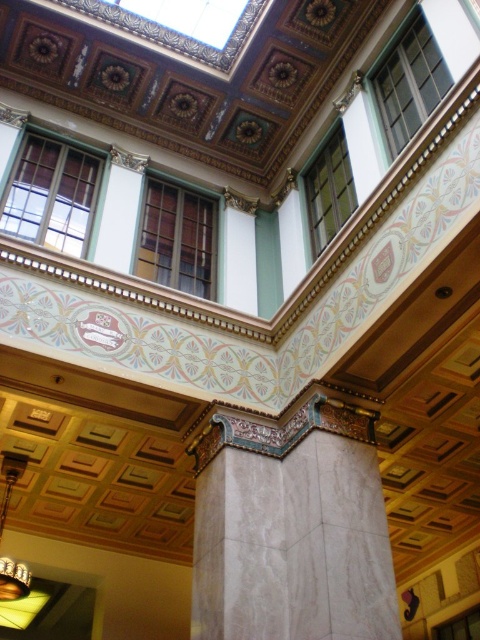
Can you confirm if white marble column at center is thinner than gold metallic chandelier at lower left?

No.

From the picture: Does white marble column at center have a greater width compared to gold metallic chandelier at lower left?

Yes.

Which is behind, point (265, 481) or point (9, 589)?

Positioned behind is point (9, 589).

The height and width of the screenshot is (640, 480). In order to click on white marble column at center in this screenshot , I will do `click(291, 528)`.